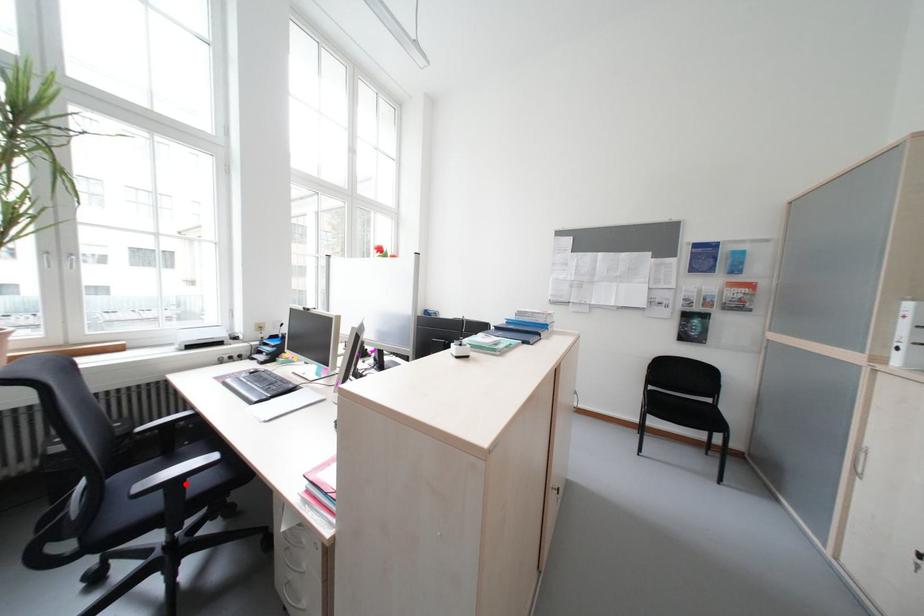
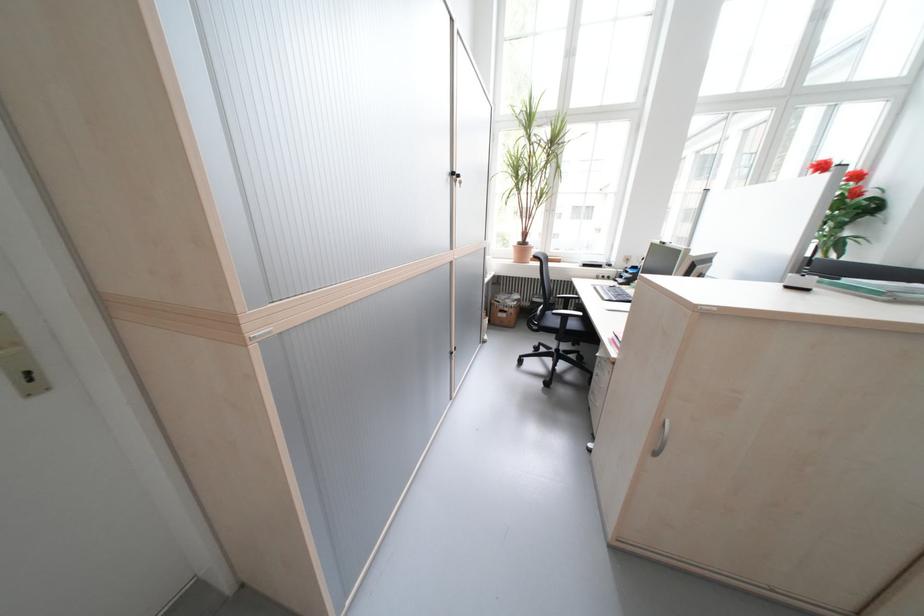
Question: I am providing you with two images of the same scene from different viewpoints. A red point is shown in image1. For the corresponding object point in image2, is it positioned nearer or farther from the camera?

Choices:
 (A) Nearer
 (B) Farther

Answer: (A)